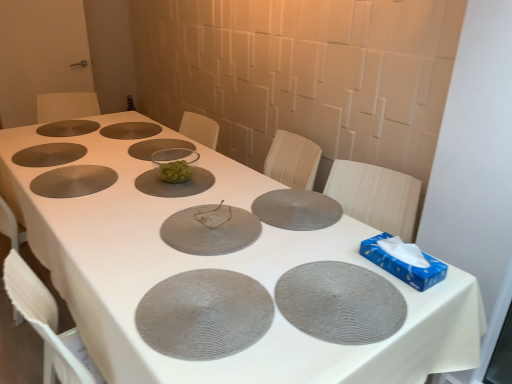
Find the location of `vacant area that lies between matte gray plate at upper left, which is the 7th glass plate in front-to-back order, and matte gray glass plate at upper left, the 10th glass plate positioned from the front`. vacant area that lies between matte gray plate at upper left, which is the 7th glass plate in front-to-back order, and matte gray glass plate at upper left, the 10th glass plate positioned from the front is located at coordinates (52, 137).